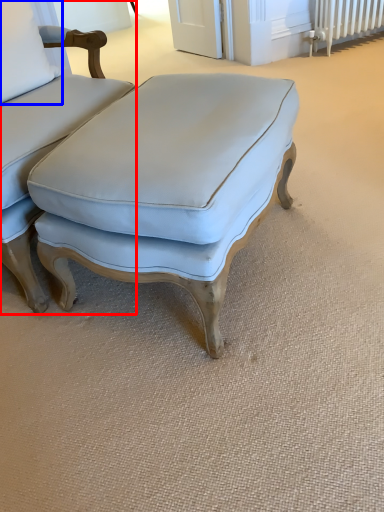
Question: Which point is further to the camera, chair (highlighted by a red box) or pillow (highlighted by a blue box)?

Choices:
 (A) chair
 (B) pillow

Answer: (B)